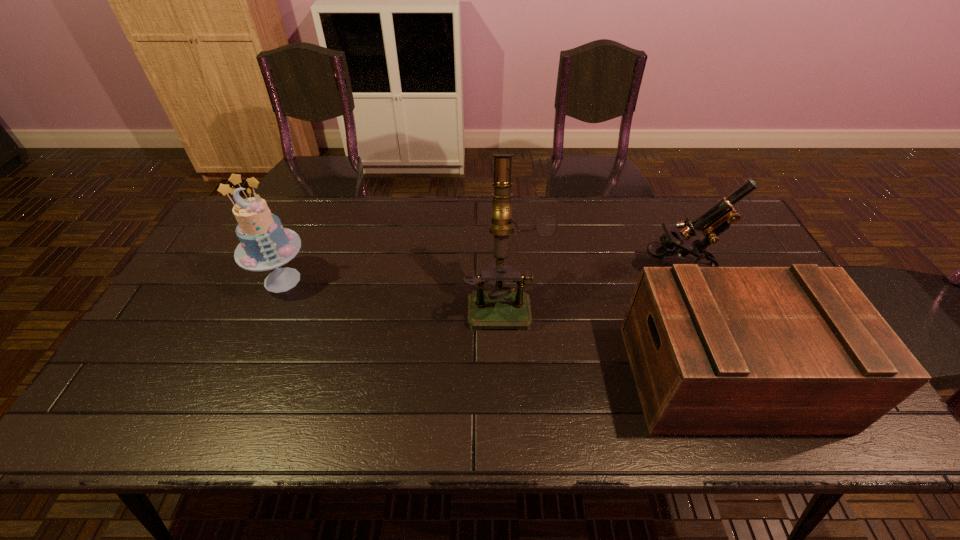
Locate an element on the screen. free space located on the left of the box is located at coordinates (472, 376).

At what (x,y) coordinates should I click in order to perform the action: click on object located in the near edge section of the desktop. Please return your answer as a coordinate pair (x, y). The width and height of the screenshot is (960, 540). Looking at the image, I should click on (714, 350).

What are the coordinates of `microscope situated at the right edge` in the screenshot? It's located at (717, 219).

Identify the location of box at the right edge. The width and height of the screenshot is (960, 540). (714, 350).

Where is `object that is at the near right corner`? object that is at the near right corner is located at coordinates (714, 350).

Locate an element on the screen. The image size is (960, 540). vacant space at the far edge of the desktop is located at coordinates pos(520,220).

This screenshot has width=960, height=540. In the image, there is a desktop. Identify the location of vacant space at the near edge. (577, 438).

In the image, there is a desktop. At what (x,y) coordinates should I click in order to perform the action: click on vacant space at the left edge. Please return your answer as a coordinate pair (x, y). Image resolution: width=960 pixels, height=540 pixels. Looking at the image, I should click on (182, 307).

Image resolution: width=960 pixels, height=540 pixels. I want to click on free point at the far right corner, so click(719, 199).

I want to click on free space between the third object from right to left and the box, so click(x=616, y=338).